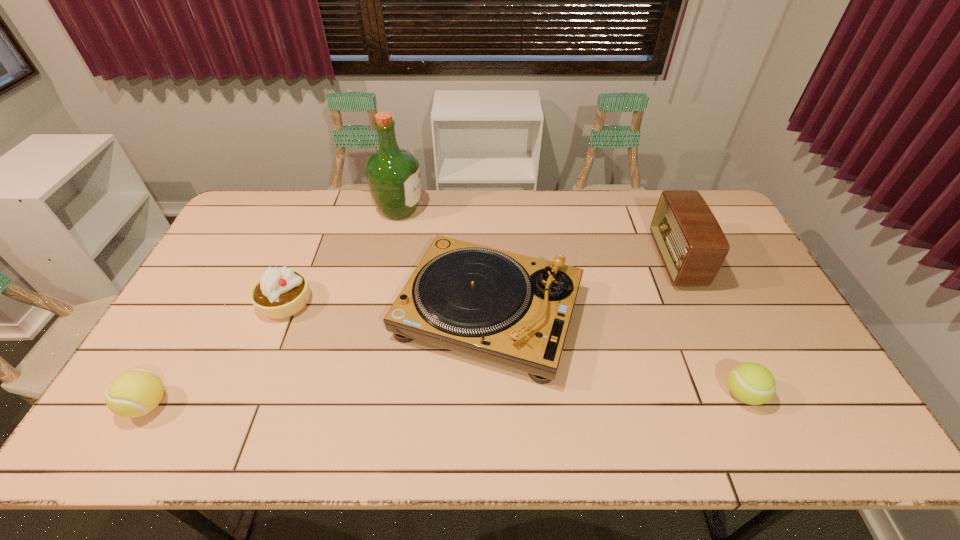
The height and width of the screenshot is (540, 960). I want to click on the tallest object, so click(393, 175).

Locate an element on the screen. Image resolution: width=960 pixels, height=540 pixels. liquor is located at coordinates (393, 175).

I want to click on the fifth shortest object, so click(x=690, y=241).

Locate an element on the screen. The image size is (960, 540). the third tallest object is located at coordinates (514, 310).

You are a GUI agent. You are given a task and a screenshot of the screen. Output one action in this format:
    pyautogui.click(x=<x>, y=<y>)
    Task: Click on the fifth object from right to left
    
    Given the screenshot: What is the action you would take?
    pyautogui.click(x=279, y=293)

In order to click on the left tennis ball in this screenshot , I will do `click(134, 393)`.

The height and width of the screenshot is (540, 960). What are the coordinates of `the right tennis ball` in the screenshot? It's located at (751, 383).

The width and height of the screenshot is (960, 540). In order to click on free space located on the front-facing side of the tallest object in this screenshot , I will do `click(446, 210)`.

Where is `vacant space located on the front-facing side of the fifth shortest object`? vacant space located on the front-facing side of the fifth shortest object is located at coordinates pyautogui.click(x=612, y=260).

Where is `free space located 0.070m on the front-facing side of the fifth shortest object`? The height and width of the screenshot is (540, 960). free space located 0.070m on the front-facing side of the fifth shortest object is located at coordinates (636, 260).